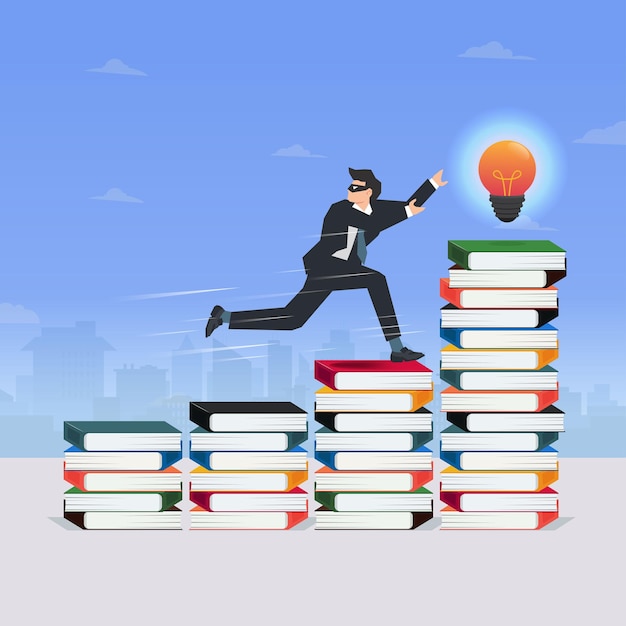
Where is `books with bright blue covers`? The width and height of the screenshot is (626, 626). books with bright blue covers is located at coordinates (173, 456), (212, 462), (327, 466), (459, 459), (459, 340).